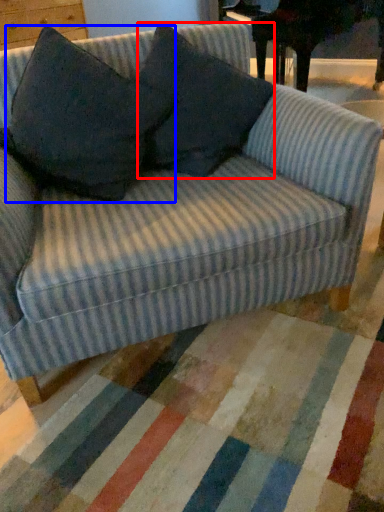
Question: Among these objects, which one is nearest to the camera, throw pillow (highlighted by a red box) or throw pillow (highlighted by a blue box)?

Choices:
 (A) throw pillow
 (B) throw pillow

Answer: (B)